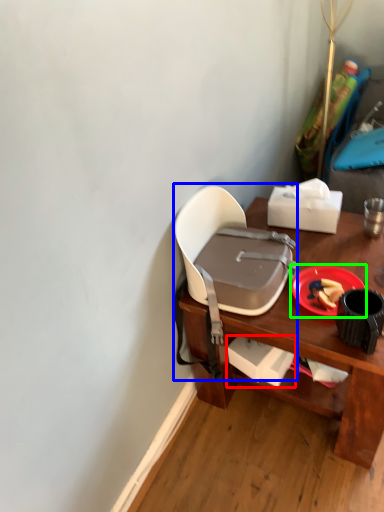
Question: Which object is the farthest from box (highlighted by a red box)? Choose among these: chair (highlighted by a blue box) or plate (highlighted by a green box).

Choices:
 (A) chair
 (B) plate

Answer: (B)